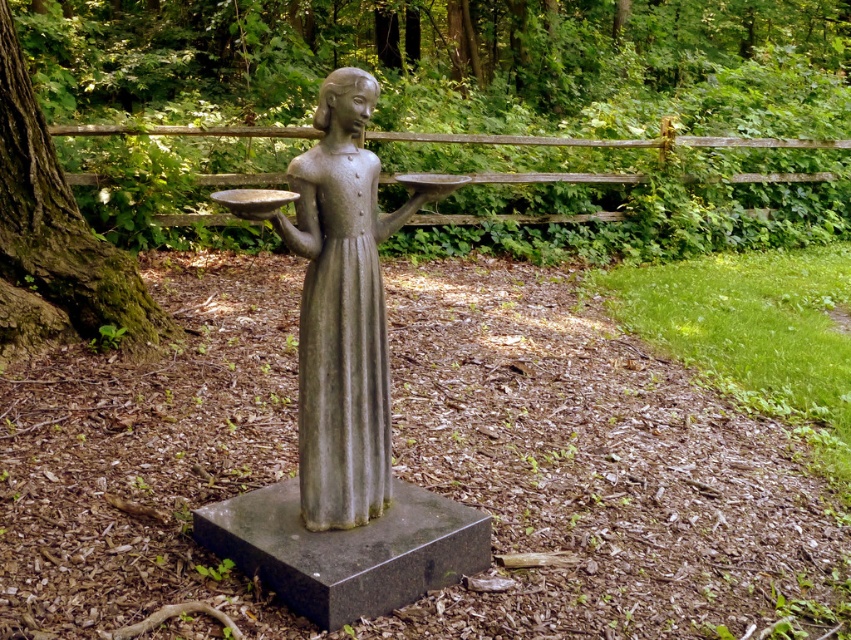
Is green mossy tree trunk at center-left bigger than green mossy tree trunk at left?

Yes.

Is green mossy tree trunk at center-left below green mossy tree trunk at left?

Actually, green mossy tree trunk at center-left is above green mossy tree trunk at left.

Describe the element at coordinates (481, 112) in the screenshot. The image size is (851, 640). I see `green mossy tree trunk at center-left` at that location.

Find the location of a particular element. green mossy tree trunk at center-left is located at coordinates (481, 112).

Based on the photo, is green mossy tree trunk at center-left shorter than bronze statue at center?

In fact, green mossy tree trunk at center-left may be taller than bronze statue at center.

Which is above, green mossy tree trunk at center-left or bronze statue at center?

green mossy tree trunk at center-left is higher up.

Who is more distant from viewer, (153, 195) or (335, 113)?

Point (153, 195)

Where is `green mossy tree trunk at center-left`? The width and height of the screenshot is (851, 640). green mossy tree trunk at center-left is located at coordinates (481, 112).

Consider the image. Can you confirm if bronze statue at center is wider than green mossy tree trunk at left?

No, bronze statue at center is not wider than green mossy tree trunk at left.

This screenshot has width=851, height=640. What do you see at coordinates (343, 307) in the screenshot?
I see `bronze statue at center` at bounding box center [343, 307].

Identify the location of bronze statue at center. coord(343,307).

Locate an element on the screen. Image resolution: width=851 pixels, height=640 pixels. bronze statue at center is located at coordinates (343, 307).